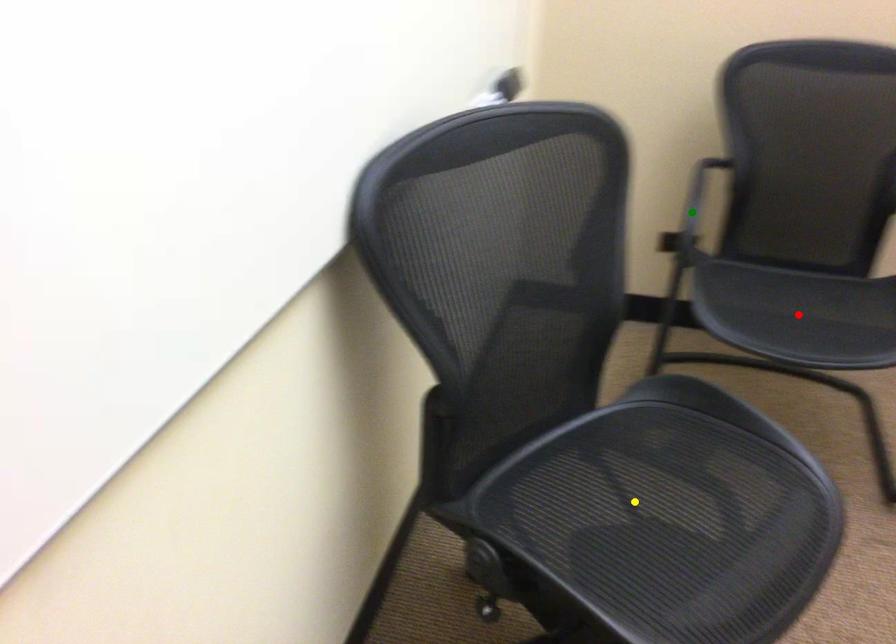
Order these from nearest to farthest:
green point, yellow point, red point

yellow point, red point, green point